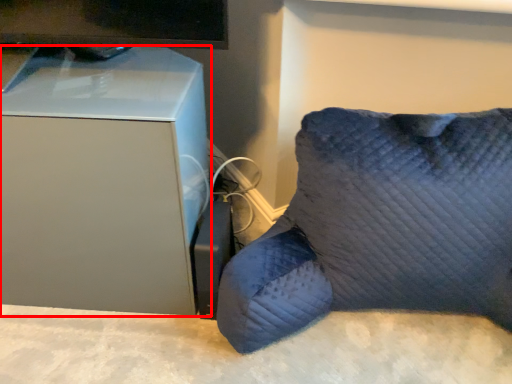
Question: From the image, what is the correct spatial relationship of furniture (annotated by the red box) in relation to furniture?

Choices:
 (A) right
 (B) left

Answer: (B)